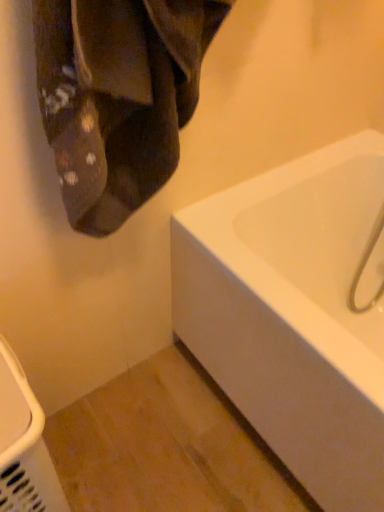
Measure the distance between point (15, 446) and camera.

A distance of 23.74 inches exists between point (15, 446) and camera.

At what (x,y) coordinates should I click in order to perform the action: click on white plastic laundry basket at lower left. Please return your answer as a coordinate pair (x, y). Looking at the image, I should click on (24, 445).

What do you see at coordinates (24, 445) in the screenshot? This screenshot has width=384, height=512. I see `white plastic laundry basket at lower left` at bounding box center [24, 445].

Identify the location of white plastic laundry basket at lower left. (24, 445).